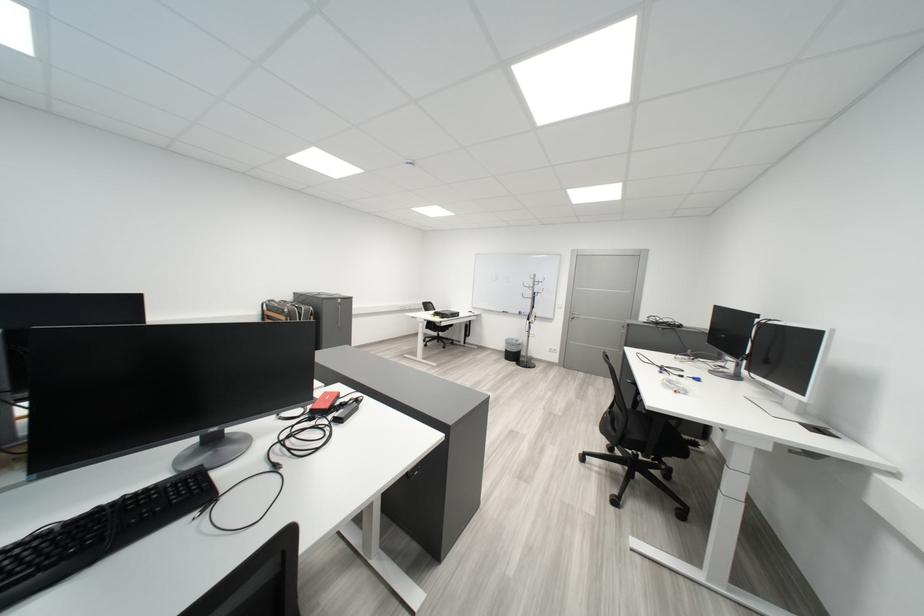
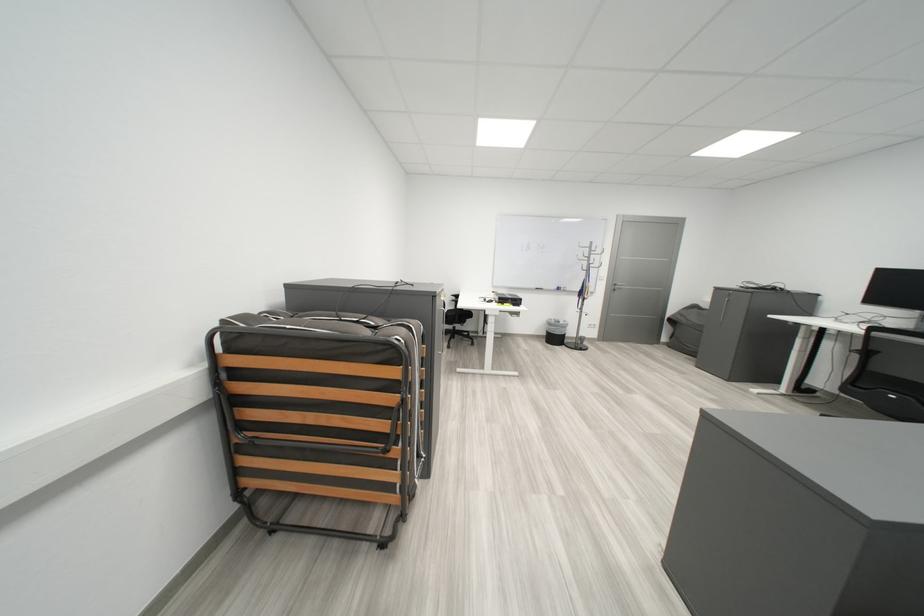
Locate, in the second image, the point that corresponds to pixel 520 344 in the first image.

(563, 326)